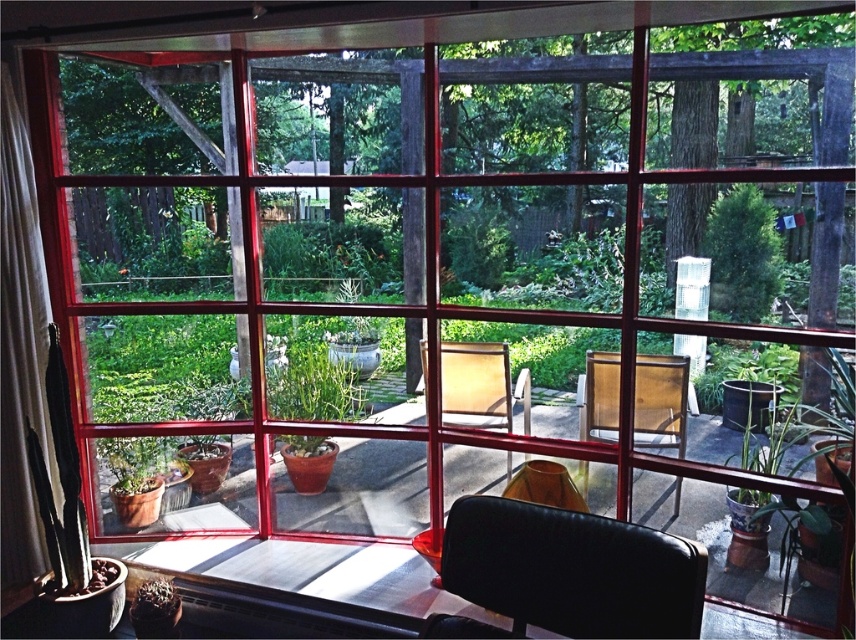
You are sitting in the matte yellow chair at center and want to reach the green matte plant at center to water it. Can you easily reach the plant without moving from the chair?

The matte yellow chair at center is positioned under the green matte plant at center, so you can easily reach the plant while sitting in the chair without needing to move.

You are sitting in the matte yellow armchair at center and want to move to the matte yellow chair at center. Which direction should you move to reach it?

The matte yellow chair at center is positioned on the right side of the matte yellow armchair at center, so you should move to your right to reach it.

You are a guest in this room and want to sit in the closest chair to the window. Which chair should you choose between the black leather armchair at lower center and the matte yellow armchair at center?

The black leather armchair at lower center is the closest to the window because it is positioned near the window as mentioned in the scene description, so you should choose the black leather armchair at lower center.